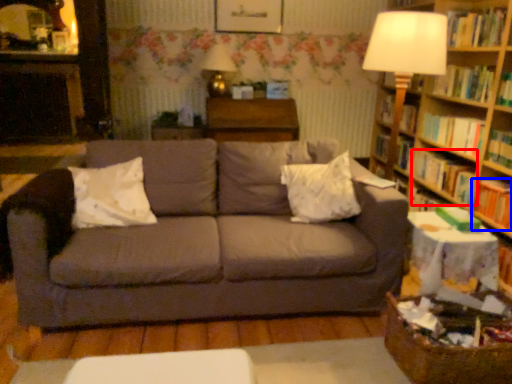
Question: Which object appears farthest to the camera in this image, book (highlighted by a red box) or book (highlighted by a blue box)?

Choices:
 (A) book
 (B) book

Answer: (A)